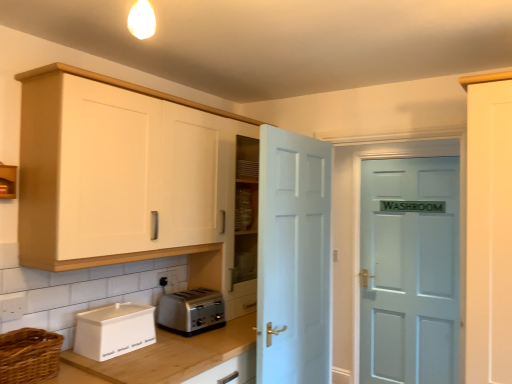
Question: Is white painted wood door at center, marked as the 1th door in a front-to-back arrangement, facing towards wooden at lower left?

Choices:
 (A) yes
 (B) no

Answer: (B)

Question: From the image's perspective, is white painted wood door at center, marked as the 1th door in a front-to-back arrangement, above wooden at lower left?

Choices:
 (A) yes
 (B) no

Answer: (A)

Question: Can you confirm if white painted wood door at center, the 2th door when ordered from right to left, is shorter than wooden at lower left?

Choices:
 (A) no
 (B) yes

Answer: (A)

Question: Is wooden at lower left surrounded by white painted wood door at center, which is the first door from left to right?

Choices:
 (A) yes
 (B) no

Answer: (B)

Question: Considering the relative positions of white painted wood door at center, which is the second door in back-to-front order, and wooden at lower left in the image provided, is white painted wood door at center, which is the second door in back-to-front order, in front of wooden at lower left?

Choices:
 (A) yes
 (B) no

Answer: (B)

Question: Is white painted wood door at center, which is the second door in back-to-front order, looking in the opposite direction of wooden at lower left?

Choices:
 (A) yes
 (B) no

Answer: (A)

Question: Is white matte cabinet at upper left, positioned as the 1th cabinetry in right-to-left order, taller than woven brown basket at lower left?

Choices:
 (A) yes
 (B) no

Answer: (A)

Question: From the image's perspective, is white matte cabinet at upper left, positioned as the 1th cabinetry in right-to-left order, below woven brown basket at lower left?

Choices:
 (A) no
 (B) yes

Answer: (A)

Question: Can you confirm if white matte cabinet at upper left, positioned as the 1th cabinetry in right-to-left order, is bigger than woven brown basket at lower left?

Choices:
 (A) yes
 (B) no

Answer: (A)

Question: Is white matte cabinet at upper left, positioned as the 1th cabinetry in right-to-left order, next to woven brown basket at lower left?

Choices:
 (A) no
 (B) yes

Answer: (A)

Question: Does white matte cabinet at upper left, positioned as the 1th cabinetry in right-to-left order, turn towards woven brown basket at lower left?

Choices:
 (A) no
 (B) yes

Answer: (A)

Question: Considering the relative sizes of white matte cabinet at upper left, which is the second cabinetry in left-to-right order, and woven brown basket at lower left in the image provided, is white matte cabinet at upper left, which is the second cabinetry in left-to-right order, wider than woven brown basket at lower left?

Choices:
 (A) no
 (B) yes

Answer: (B)

Question: Is white plastic electric outlet at lower center to the right of satin silver toaster at lower center from the viewer's perspective?

Choices:
 (A) yes
 (B) no

Answer: (B)